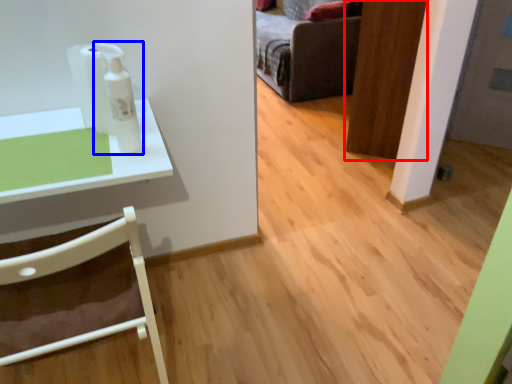
Question: Among these objects, which one is farthest to the camera, door (highlighted by a red box) or toiletry (highlighted by a blue box)?

Choices:
 (A) door
 (B) toiletry

Answer: (A)